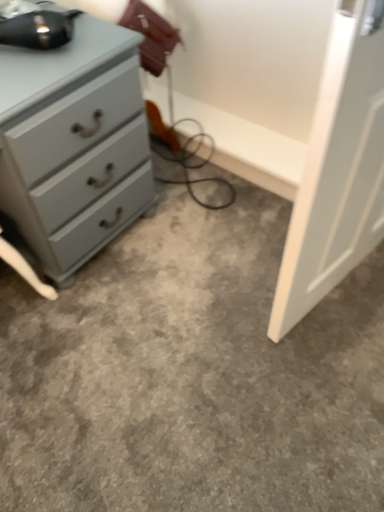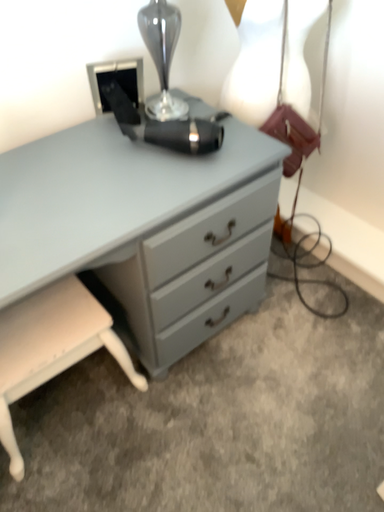
Question: How did the camera likely rotate when shooting the video?

Choices:
 (A) rotated downward
 (B) rotated upward

Answer: (B)